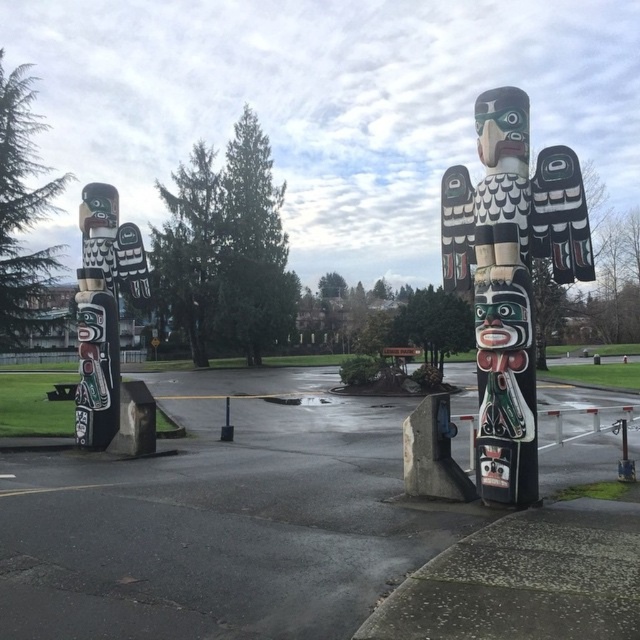
You are an artist planning to photograph both the black painted wood totem pole at right and the polished wood totem pole at left. You want to capture their widths in your composition. Which totem pole has a greater width?

The polished wood totem pole at left has a greater width compared to the black painted wood totem pole at right.

You are driving a delivery truck that is 18 feet long. You need to park your truck in the smooth asphalt parking lot at center while avoiding the polished wood totem pole at left. Is there enough space between them to safely park your truck?

The smooth asphalt parking lot at center and polished wood totem pole at left are 21.56 feet apart. Since your truck is 18 feet long, there is sufficient space between them to park safely without hitting the totem pole.